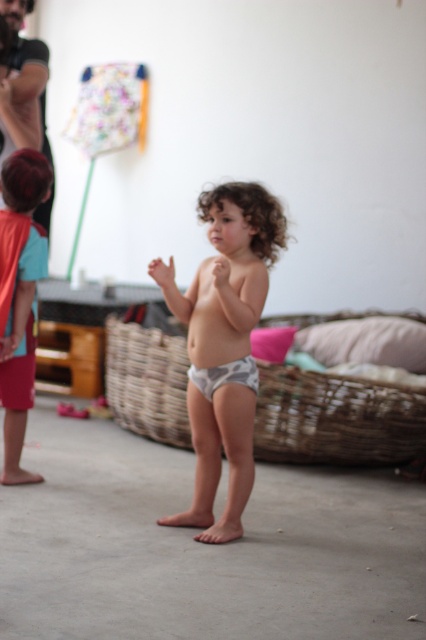
You are a photographer adjusting your camera settings. You notice two points in the scene at coordinates point (31, 172) and point (244, 376). Which point is closer to the camera lens?

Point (31, 172) is further to the camera than point (244, 376), so the closer point to the camera lens is point (244, 376).